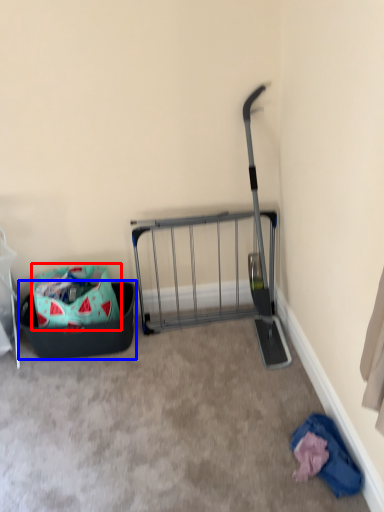
Question: Which object appears closest to the camera in this image, bag (highlighted by a red box) or laundry basket (highlighted by a blue box)?

Choices:
 (A) bag
 (B) laundry basket

Answer: (A)